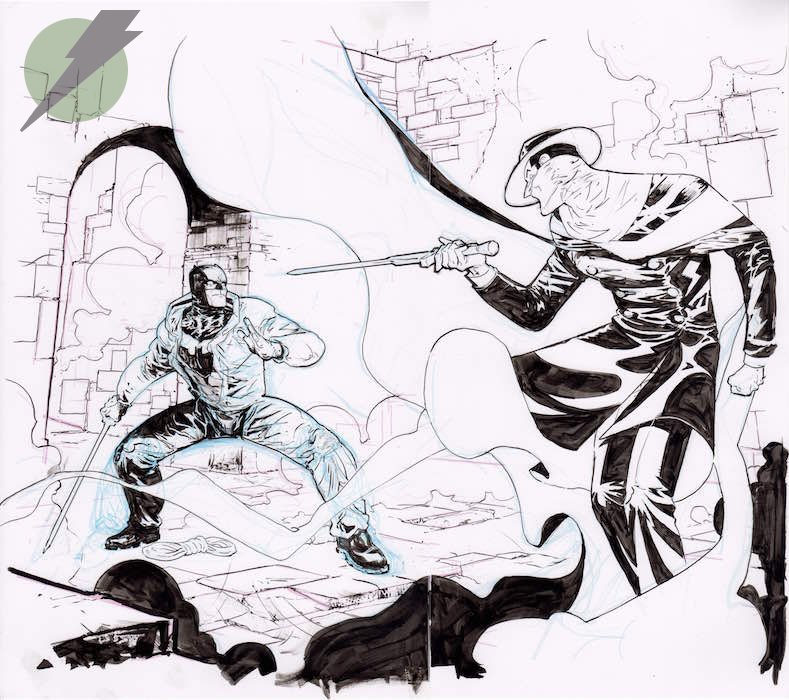
I want to click on coat, so click(641, 311).